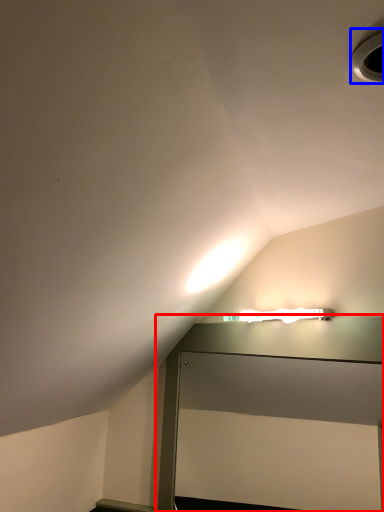
Question: Among these objects, which one is farthest to the camera, table (highlighted by a red box) or hole (highlighted by a blue box)?

Choices:
 (A) table
 (B) hole

Answer: (A)